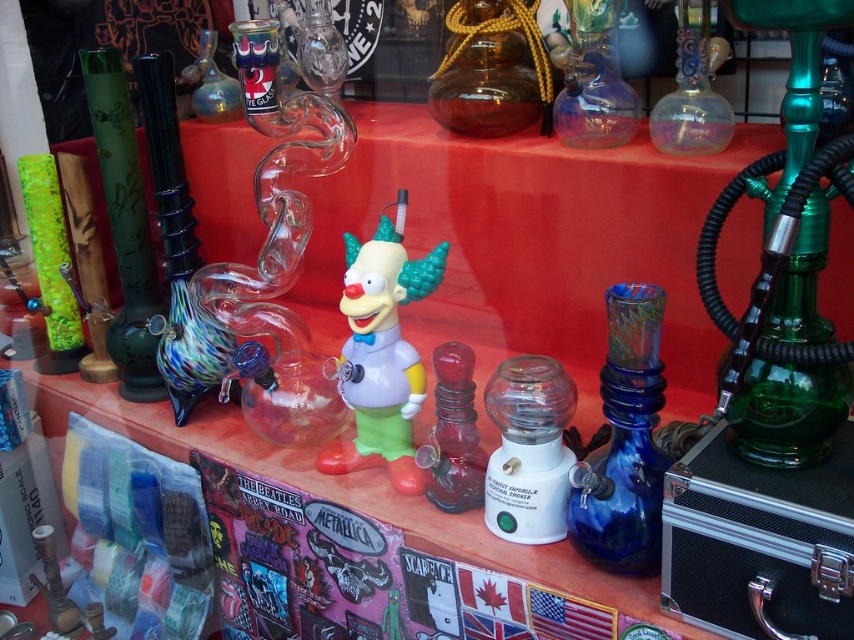
Can you confirm if translucent purple glass vase at center is wider than transparent glass pipe at upper right?

Yes.

Can you confirm if translucent purple glass vase at center is positioned to the left of transparent glass pipe at upper right?

Correct, you'll find translucent purple glass vase at center to the left of transparent glass pipe at upper right.

Measure the distance between translucent purple glass vase at center and camera.

They are 1.08 meters apart.

Find the location of a particular element. translucent purple glass vase at center is located at coordinates (594, 80).

Which is above, rubber clown at center or transparent glass pipe at upper right?

Positioned higher is transparent glass pipe at upper right.

Who is more forward, (366,403) or (685,131)?

Positioned in front is point (366,403).

Does point (384, 433) come behind point (694, 40)?

No, it is not.

At what (x,y) coordinates should I click in order to perform the action: click on rubber clown at center. Please return your answer as a coordinate pair (x, y). The width and height of the screenshot is (854, 640). Looking at the image, I should click on (382, 353).

Between point (817, 218) and point (607, 483), which one is positioned behind?

The point (607, 483) is behind.

Looking at this image, who is more forward, (802, 49) or (624, 428)?

Point (802, 49) is more forward.

The height and width of the screenshot is (640, 854). I want to click on green glass hookah at right, so click(788, 412).